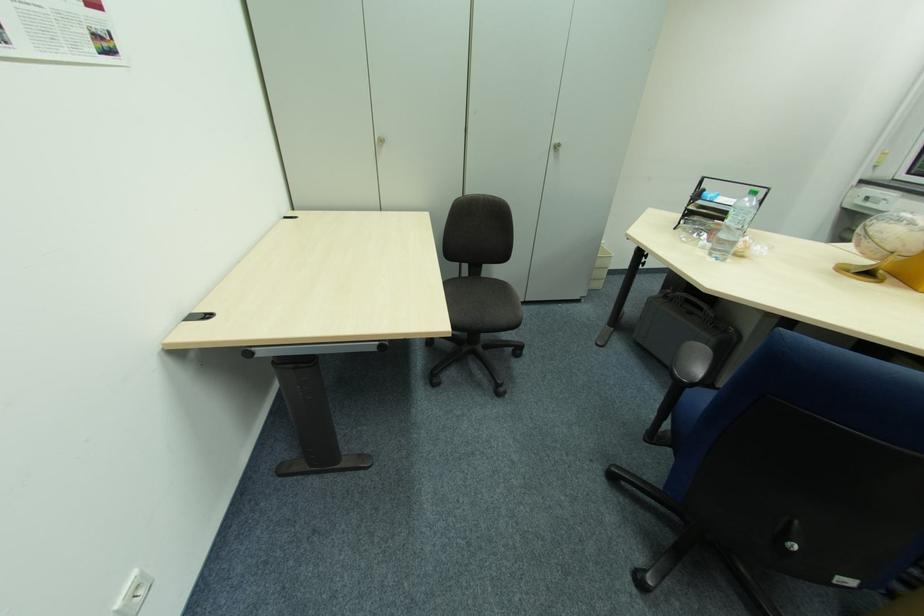
Find where to sit the dark chair sitting surface. Please return your answer as a coordinate pair (x, y).

(480, 292)